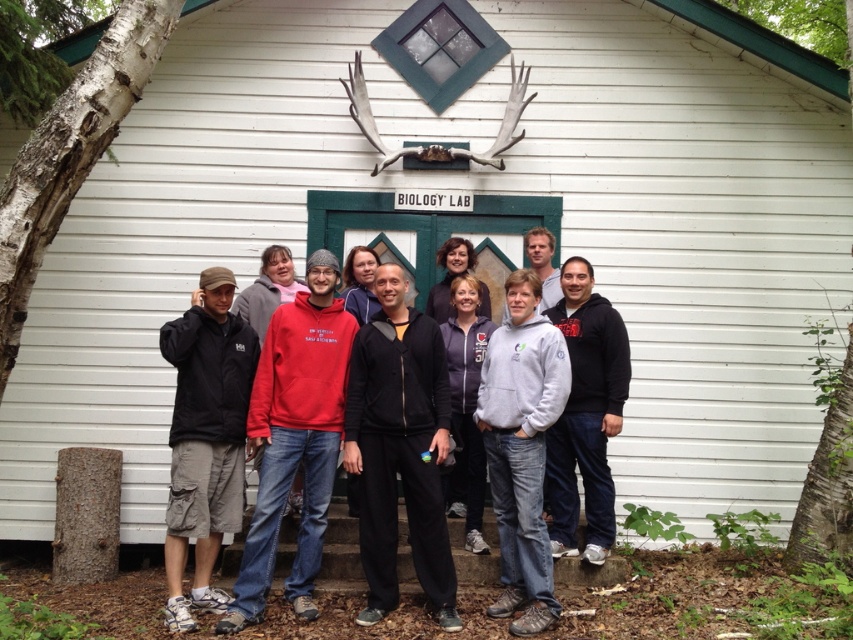
Consider the image. Is black matte jacket at center positioned behind dark gray cotton cargo shorts at lower left?

That is True.

Consider the image. Which is below, black matte jacket at center or dark gray cotton cargo shorts at lower left?

black matte jacket at center is below.

This screenshot has width=853, height=640. I want to click on black matte jacket at center, so click(399, 449).

Image resolution: width=853 pixels, height=640 pixels. In order to click on black matte jacket at center in this screenshot , I will do `click(399, 449)`.

How much distance is there between dark gray hoodie at center and gray fleece jacket at center?

The distance of dark gray hoodie at center from gray fleece jacket at center is 35.75 inches.

Is point (592, 342) in front of point (554, 296)?

That is True.

What are the coordinates of `dark gray hoodie at center` in the screenshot? It's located at (585, 413).

Can you confirm if dark gray cotton cargo shorts at lower left is positioned to the right of dark gray hoodie at center?

No, dark gray cotton cargo shorts at lower left is not to the right of dark gray hoodie at center.

Can you confirm if dark gray cotton cargo shorts at lower left is positioned to the left of dark gray hoodie at center?

Correct, you'll find dark gray cotton cargo shorts at lower left to the left of dark gray hoodie at center.

Image resolution: width=853 pixels, height=640 pixels. In order to click on dark gray cotton cargo shorts at lower left in this screenshot , I will do `click(206, 438)`.